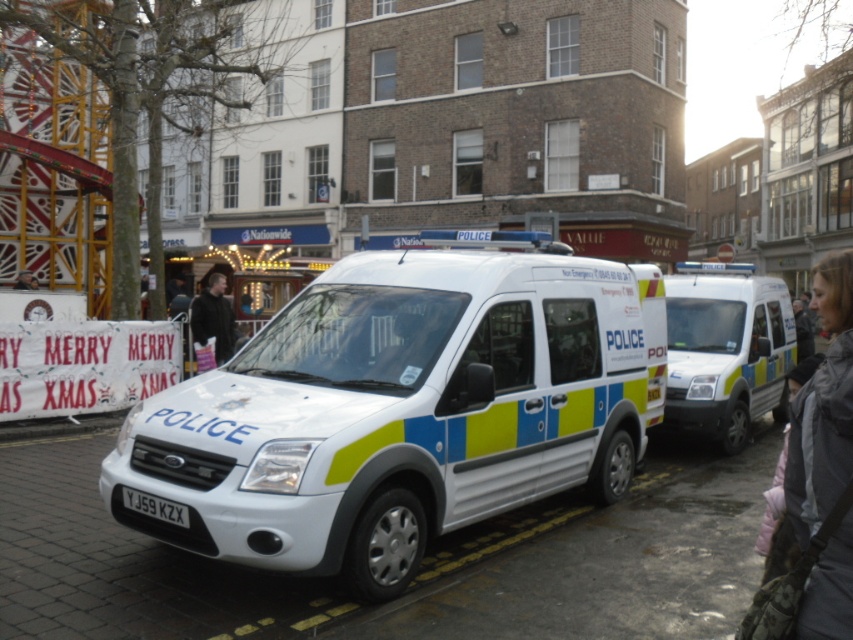
Question: Which point is closer to the camera?

Choices:
 (A) (219, 330)
 (B) (833, 376)

Answer: (B)

Question: Which object appears closest to the camera in this image?

Choices:
 (A) gray fabric jacket at right
 (B) black leather jacket at center
 (C) white glossy van at center

Answer: (A)

Question: Can you confirm if white glossy van at center is thinner than gray fabric jacket at right?

Choices:
 (A) no
 (B) yes

Answer: (B)

Question: Does white glossy van at center appear on the left side of gray fabric jacket at right?

Choices:
 (A) no
 (B) yes

Answer: (B)

Question: Is white glossy police van at center to the left of black leather jacket at center from the viewer's perspective?

Choices:
 (A) no
 (B) yes

Answer: (A)

Question: Which object is farther from the camera taking this photo?

Choices:
 (A) black leather jacket at center
 (B) gray fabric jacket at right

Answer: (A)